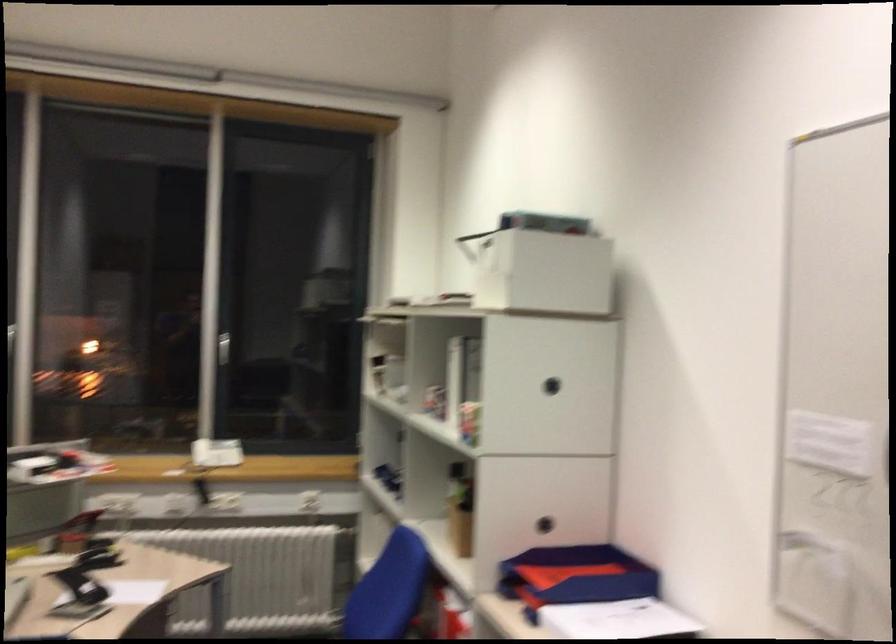
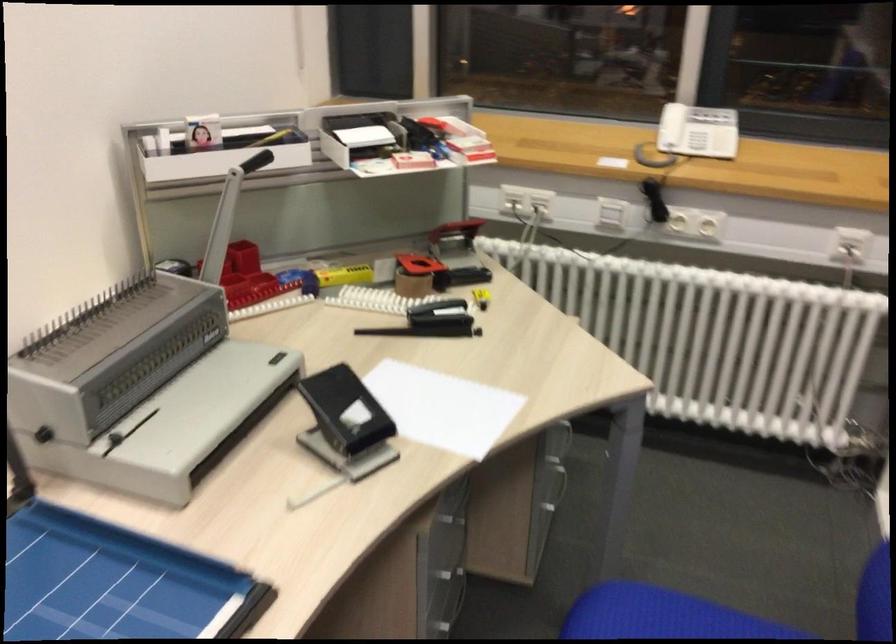
The point at (75, 527) is marked in the first image. Where is the corresponding point in the second image?

(454, 236)